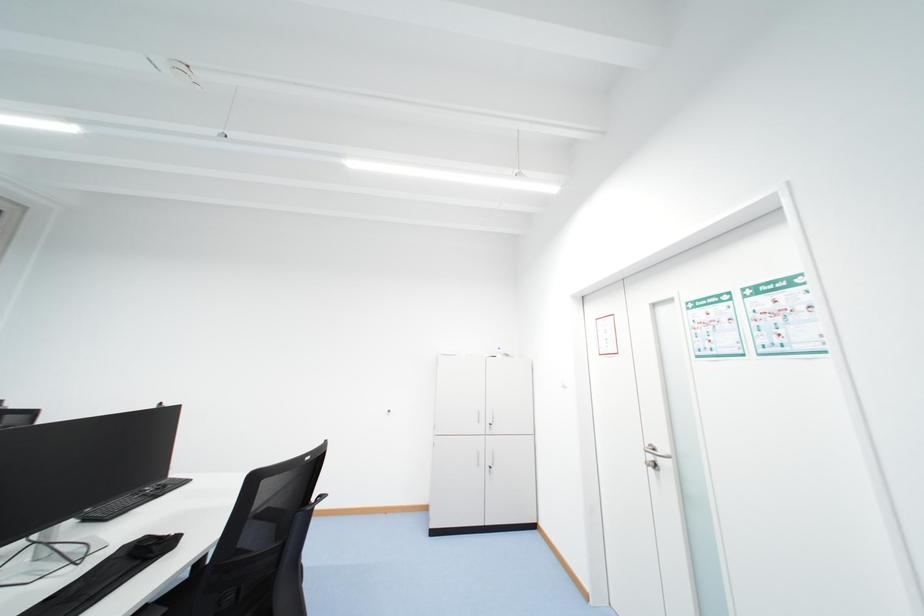
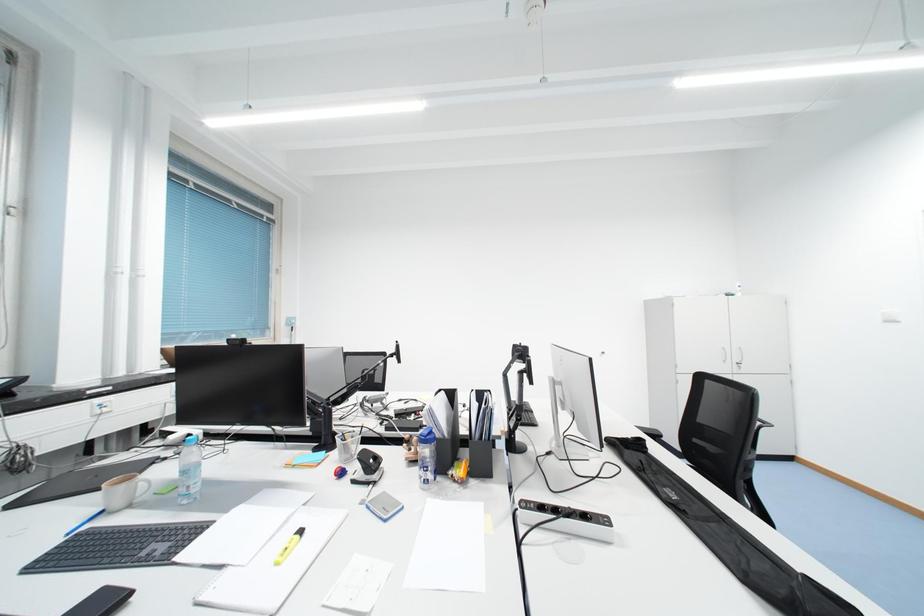
Question: What movement of the cameraman would produce the second image?

Choices:
 (A) Left
 (B) Right
 (C) Forward
 (D) Backward

Answer: (A)